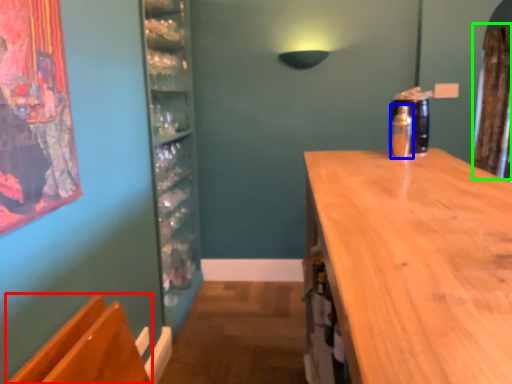
Question: Based on their relative distances, which object is farther from armchair (highlighted by a red box)? Choose from bottle (highlighted by a blue box) and curtain (highlighted by a green box).

Choices:
 (A) bottle
 (B) curtain

Answer: (B)